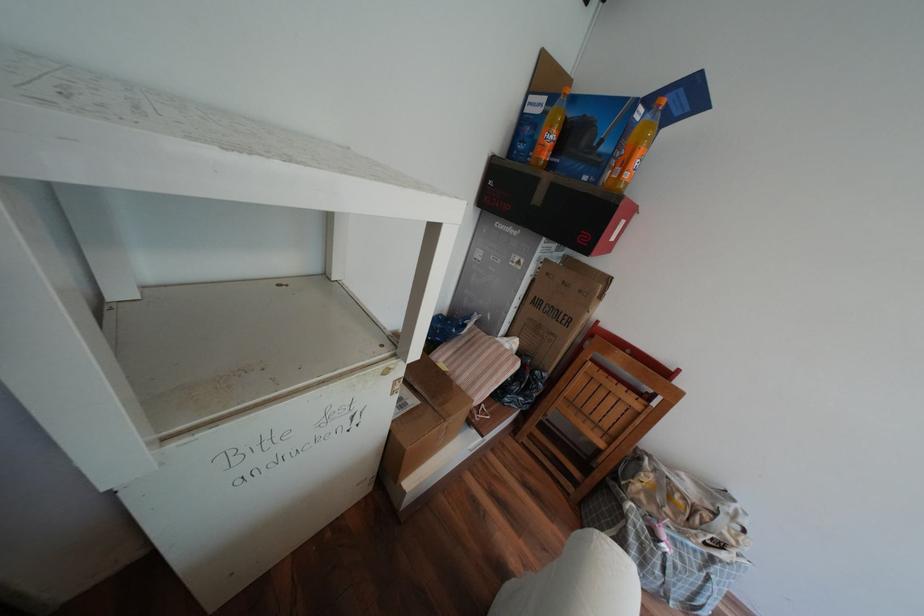
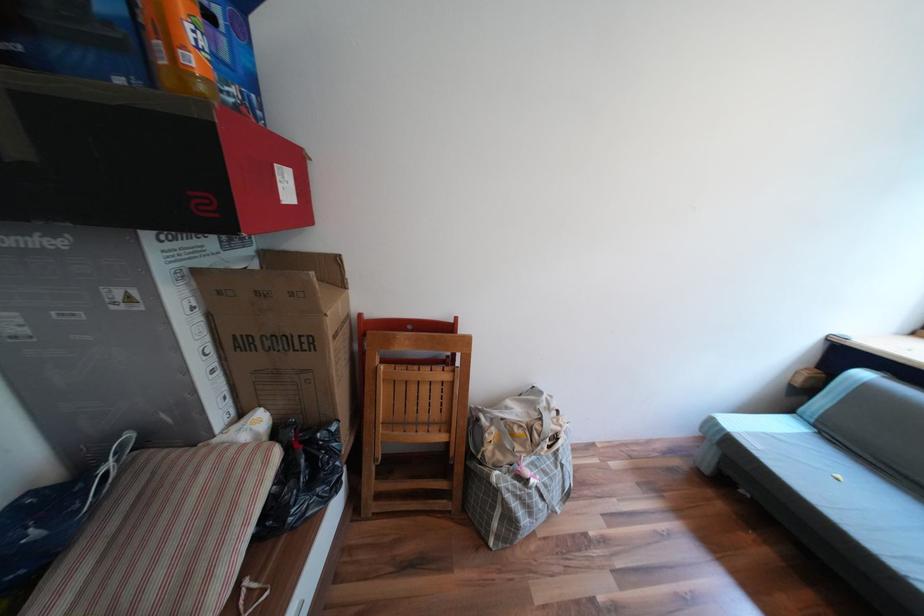
Question: I am providing you with two images of the same scene from different viewpoints. Which of the following objects are not visible in image2?

Choices:
 (A) black plastic bag
 (B) large cardboard box
 (C) red and black box
 (D) none of these

Answer: (D)